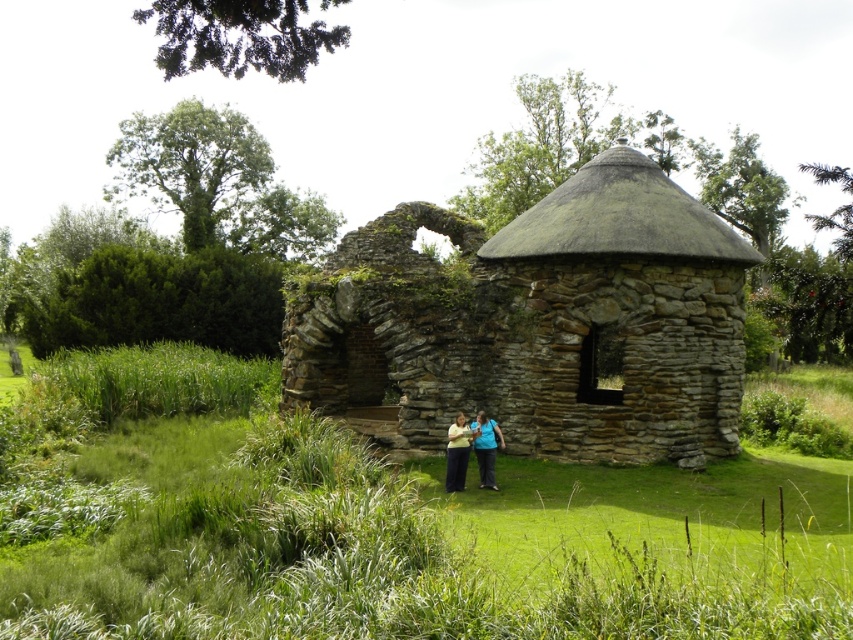
You are a hiker who wants to cross from the green grass at center to the dark blue fabric at center. Can you walk directly between them without any obstacles?

The green grass at center and dark blue fabric at center are 9.64 meters apart, so yes, you can walk directly between them without any obstacles as there is enough space.

You are standing at the entrance of the rustic stone structure and want to place a decorative stone at the exact center of the green grass at center. According to the coordinates provided, where should you place the stone?

The green grass at center is located at point (378, 524), so you should place the decorative stone at those coordinates to mark its center.